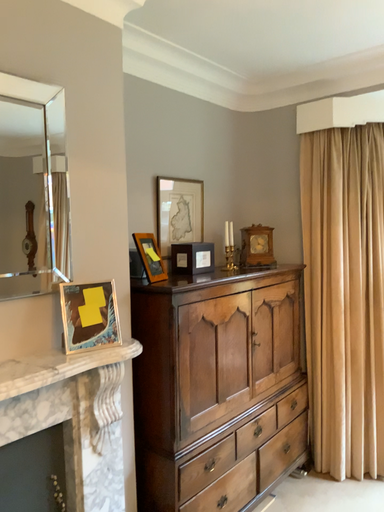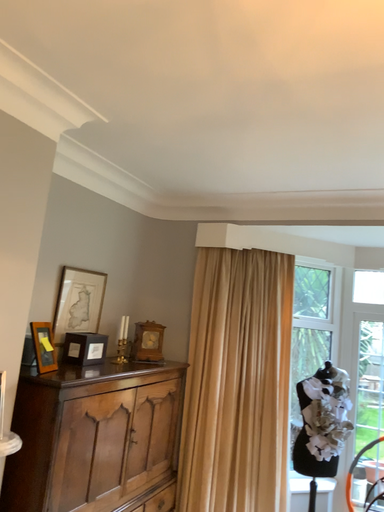
Question: How did the camera likely rotate when shooting the video?

Choices:
 (A) rotated upward
 (B) rotated downward

Answer: (A)